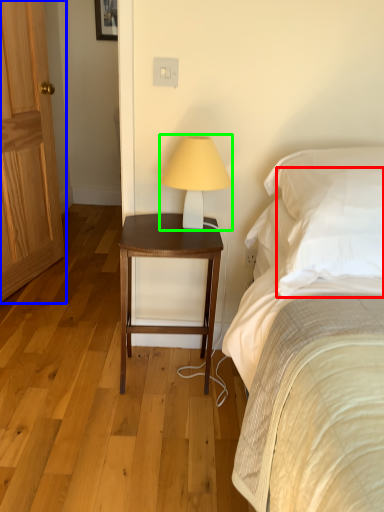
Question: Which object is the closest to the pillow (highlighted by a red box)? Choose among these: door (highlighted by a blue box) or table lamp (highlighted by a green box).

Choices:
 (A) door
 (B) table lamp

Answer: (B)